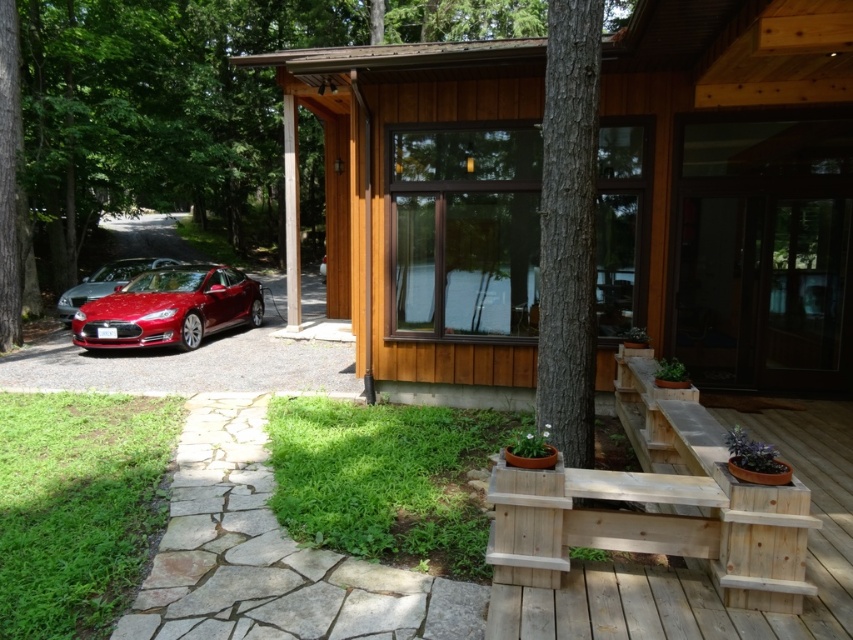
You are a delivery person approaching the wooden cabin at center and the shiny red car at left. Which object will you encounter first as you walk from the driveway towards the house?

The wooden cabin at center will be encountered first because it is positioned in front of the shiny red car at left, meaning it is closer to the delivery person approaching from the driveway.

Consider the image. You are a delivery person trying to park your van between the wooden cabin at center and the shiny metallic red sports car at left. Can you fit your van, which is 2 meters wide, in the space between them?

The wooden cabin at center is wider than the shiny metallic red sports car at left. However, the description does not provide the exact distance between them, so it is unclear if the 2 meter wide van can fit. More information about the spacing between the two objects is needed to determine this.

You are standing at the bottom of the driveway and want to walk to the wooden cabin at center. Which direction should you go relative to the shiny red car at left?

The wooden cabin at center is above the shiny red car at left, so you should walk upward in the direction away from the shiny red car at left to reach the wooden cabin at center.